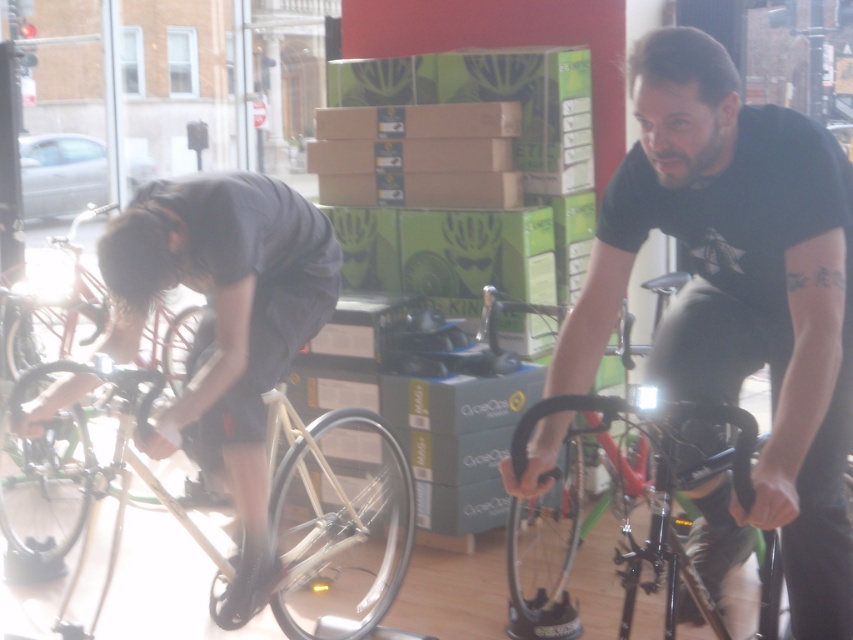
Question: Is the position of dark gray fabric shirt at left less distant than that of clear white tire at center?

Choices:
 (A) no
 (B) yes

Answer: (B)

Question: Among these points, which one is farthest from the camera?

Choices:
 (A) (799, 472)
 (B) (338, 484)
 (C) (61, 536)

Answer: (C)

Question: Can you confirm if clear white tire at center is wider than shiny silver rim at lower left?

Choices:
 (A) yes
 (B) no

Answer: (B)

Question: Does shiny silver bicycle at left appear on the right side of shiny silver rim at center?

Choices:
 (A) no
 (B) yes

Answer: (A)

Question: Which object is positioned farthest from the shiny silver rim at lower left?

Choices:
 (A) clear white tire at center
 (B) shiny silver bicycle at left
 (C) shiny silver rim at center

Answer: (C)

Question: Which of these objects is positioned closest to the wooden natural bike at center?

Choices:
 (A) shiny silver rim at center
 (B) shiny silver bicycle at left

Answer: (A)